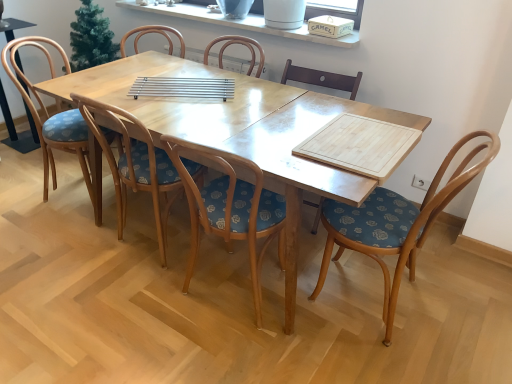
Where is `free space to the left of wooden chair with floral upholstery at center, the fourth chair when ordered from right to left`? free space to the left of wooden chair with floral upholstery at center, the fourth chair when ordered from right to left is located at coordinates (89, 246).